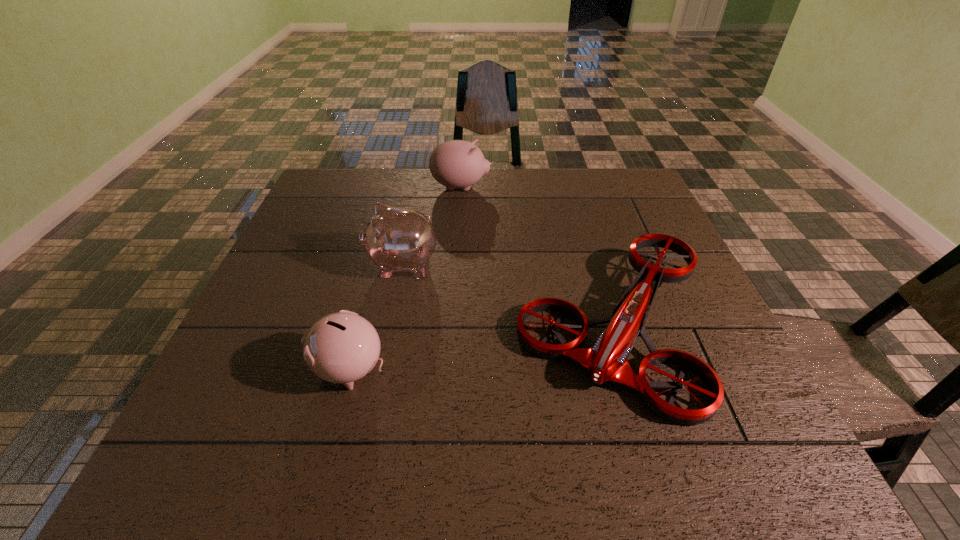
The width and height of the screenshot is (960, 540). I want to click on vacant space located on the left of the rightmost object, so click(397, 327).

Identify the location of object located in the far edge section of the desktop. This screenshot has width=960, height=540. (457, 163).

Identify the location of object present at the right edge. (607, 360).

At what (x,y) coordinates should I click in order to perform the action: click on vacant area at the far edge of the desktop. Please return your answer as a coordinate pair (x, y). The height and width of the screenshot is (540, 960). Looking at the image, I should click on (467, 201).

This screenshot has width=960, height=540. Find the location of `vacant position at the left edge of the desktop`. vacant position at the left edge of the desktop is located at coordinates (279, 358).

This screenshot has height=540, width=960. Find the location of `free space at the right edge of the desktop`. free space at the right edge of the desktop is located at coordinates (700, 292).

Find the location of `free spot at the far left corner of the desktop`. free spot at the far left corner of the desktop is located at coordinates tap(365, 176).

I want to click on vacant point located between the farthest object and the nearest piggy bank, so click(405, 278).

At what (x,y) coordinates should I click in order to perform the action: click on free space between the nearest piggy bank and the farthest object. Please return your answer as a coordinate pair (x, y). Looking at the image, I should click on (405, 278).

Where is `vacant space in between the farthest piggy bank and the nearest piggy bank`? vacant space in between the farthest piggy bank and the nearest piggy bank is located at coordinates (405, 278).